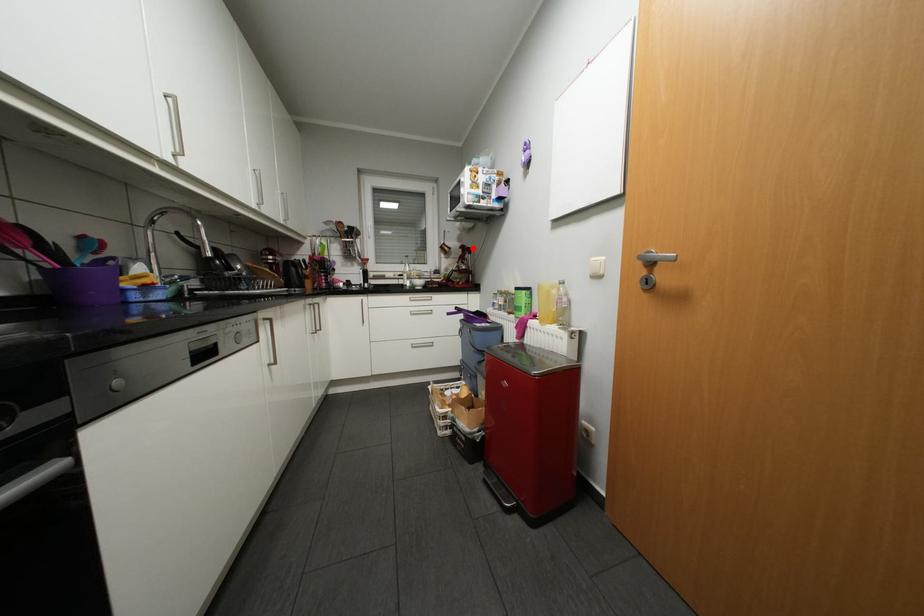
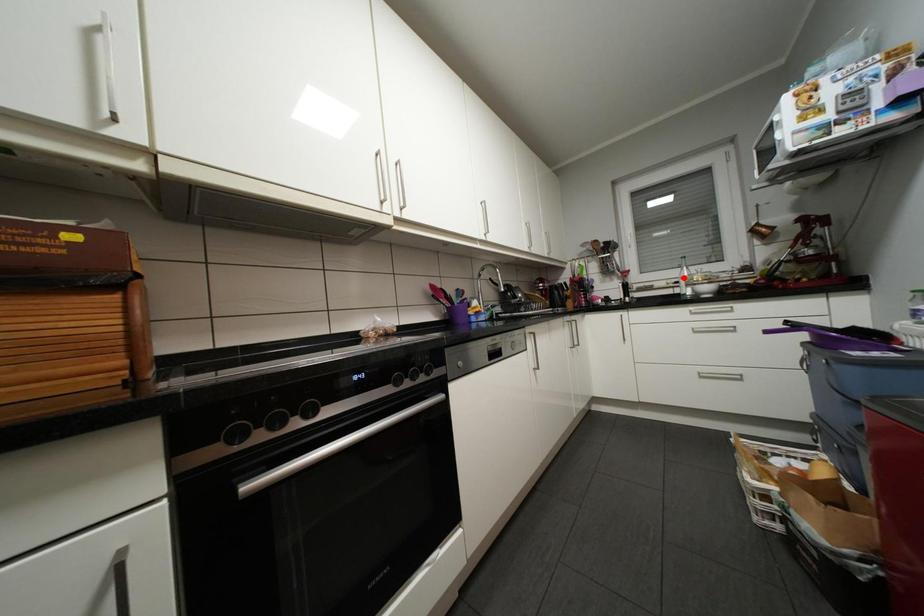
I am providing you with two images of the same scene from different viewpoints. A red point is marked on the first image and another point is marked on the second image. Is the red point in image1 aligned with the point shown in image2?

No